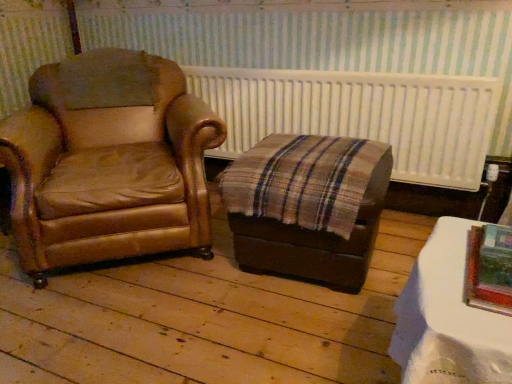
Question: From the image's perspective, is white glossy table at lower right on top of metallic silver picture frame at lower right?

Choices:
 (A) yes
 (B) no

Answer: (B)

Question: Does white glossy table at lower right come behind metallic silver picture frame at lower right?

Choices:
 (A) no
 (B) yes

Answer: (A)

Question: Can you confirm if white glossy table at lower right is taller than metallic silver picture frame at lower right?

Choices:
 (A) yes
 (B) no

Answer: (A)

Question: Does white glossy table at lower right touch metallic silver picture frame at lower right?

Choices:
 (A) yes
 (B) no

Answer: (A)

Question: From a real-world perspective, is white glossy table at lower right physically above metallic silver picture frame at lower right?

Choices:
 (A) no
 (B) yes

Answer: (A)

Question: Does point pyautogui.click(x=111, y=238) appear closer or farther from the camera than point pyautogui.click(x=470, y=241)?

Choices:
 (A) farther
 (B) closer

Answer: (A)

Question: From the image's perspective, relative to metallic silver picture frame at lower right, is brown leather chair at left above or below?

Choices:
 (A) above
 (B) below

Answer: (A)

Question: In the image, is brown leather chair at left positioned in front of or behind metallic silver picture frame at lower right?

Choices:
 (A) front
 (B) behind

Answer: (B)

Question: From a real-world perspective, relative to metallic silver picture frame at lower right, is brown leather chair at left vertically above or below?

Choices:
 (A) below
 (B) above

Answer: (A)

Question: From the image's perspective, is metallic silver picture frame at lower right positioned above or below brown leather chair at left?

Choices:
 (A) below
 (B) above

Answer: (A)

Question: Is metallic silver picture frame at lower right bigger or smaller than brown leather chair at left?

Choices:
 (A) small
 (B) big

Answer: (A)

Question: In terms of width, does metallic silver picture frame at lower right look wider or thinner when compared to brown leather chair at left?

Choices:
 (A) wide
 (B) thin

Answer: (B)

Question: From a real-world perspective, is metallic silver picture frame at lower right positioned above or below brown leather chair at left?

Choices:
 (A) below
 (B) above

Answer: (B)

Question: From the image's perspective, is white textured radiator at upper center located above or below white glossy table at lower right?

Choices:
 (A) below
 (B) above

Answer: (B)

Question: From a real-world perspective, is white textured radiator at upper center above or below white glossy table at lower right?

Choices:
 (A) below
 (B) above

Answer: (B)